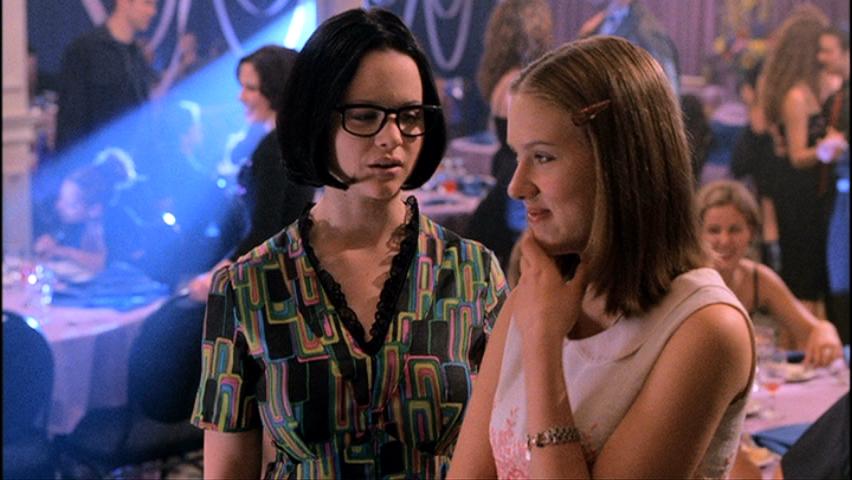
At what (x,y) coordinates should I click in order to perform the action: click on table. Please return your answer as a coordinate pair (x, y). Looking at the image, I should click on (780, 416), (60, 337), (445, 202), (486, 151).